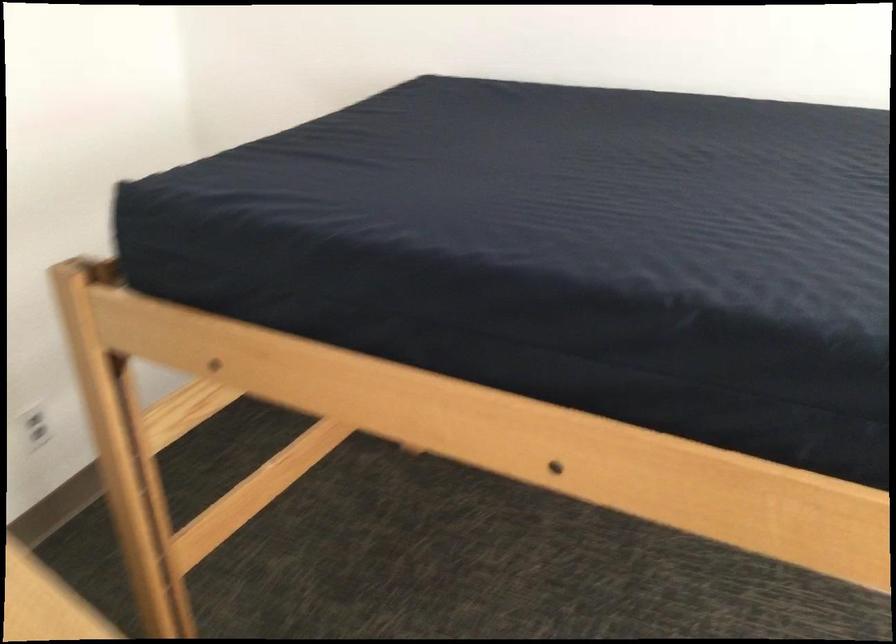
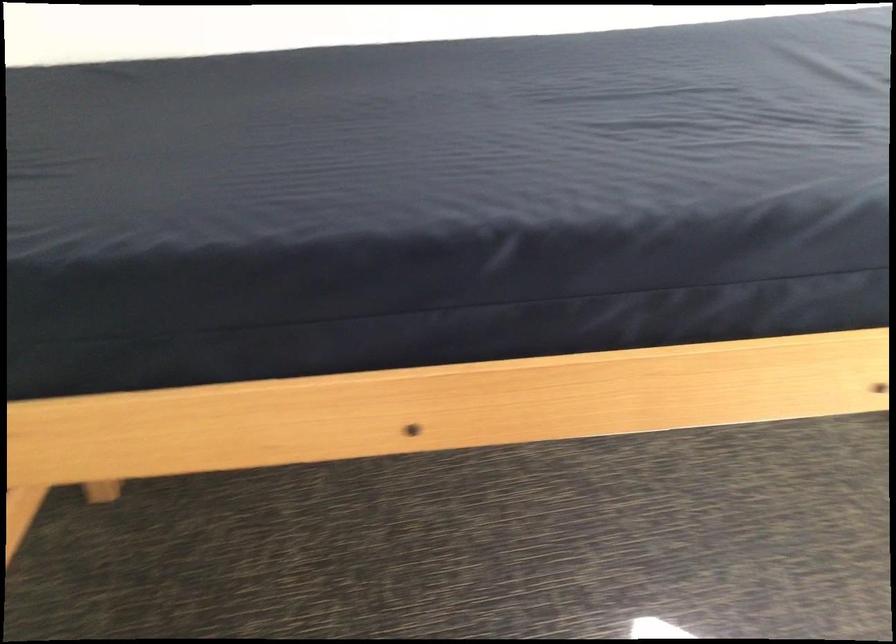
Question: The images are taken continuously from a first-person perspective. In which direction is your viewpoint rotating?

Choices:
 (A) Left
 (B) Right
 (C) Up
 (D) Down

Answer: (B)